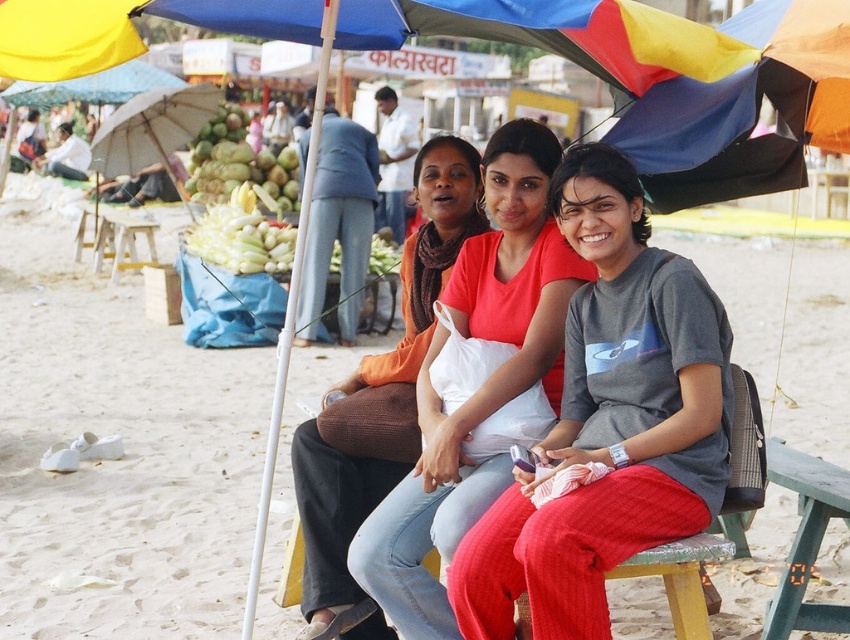
Who is more distant from viewer, (361,416) or (120,230)?

The point (120,230) is more distant.

Between brown fabric scarf at center and wooden stool at lower left, which one is positioned lower?

brown fabric scarf at center is lower down.

At what (x,y) coordinates should I click in order to perform the action: click on brown fabric scarf at center. Please return your answer as a coordinate pair (x, y). Looking at the image, I should click on (380, 392).

Is point (112, 362) closer to viewer compared to point (44, 17)?

That is False.

This screenshot has width=850, height=640. I want to click on beige sand at lower center, so click(x=123, y=445).

Is green plastic bench at lower right behind green matte coconut at upper left?

No, green plastic bench at lower right is in front of green matte coconut at upper left.

Can you confirm if green plastic bench at lower right is positioned to the left of green matte coconut at upper left?

Incorrect, green plastic bench at lower right is not on the left side of green matte coconut at upper left.

This screenshot has width=850, height=640. Find the location of `green plastic bench at lower right`. green plastic bench at lower right is located at coordinates (805, 540).